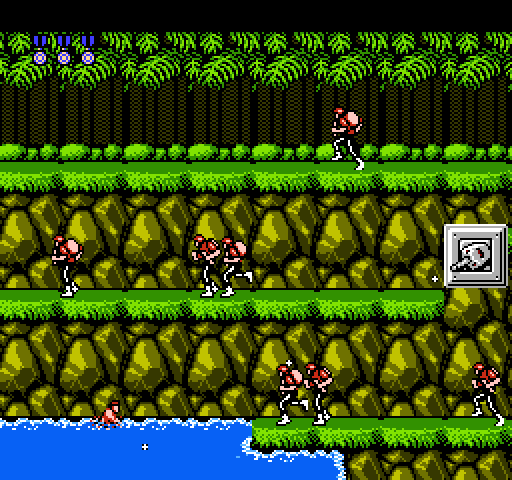
Where is `wall`? wall is located at coordinates (x=391, y=237).